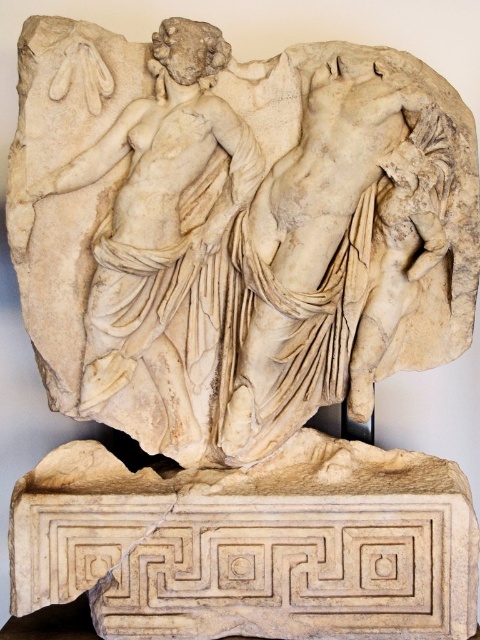
You are an art conservator examining the classical marble relief sculpture. You notice two points of interest marked on the relief at coordinates point (301, 356) and point (187, 301). Which point is closer to the viewer?

Point (187, 301) is closer to the viewer because the description states that point (301, 356) is behind it.

Consider the image. You are an art conservator examining the classical marble relief sculpture. You notice two parts of the sculpture labeled as the white marble sculpture at center and the white marble torso at center. Based on their positions, which one is closer to you?

The white marble sculpture at center is closer to you since it is in front of the white marble torso at center.